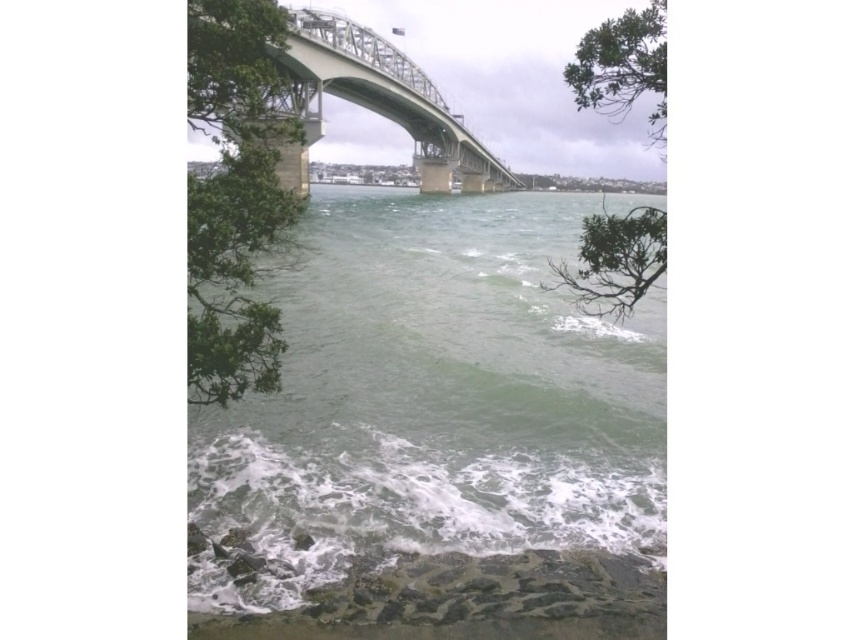
Which of these two, greenish water at center or green leafy branch at upper right, stands taller?

With more height is green leafy branch at upper right.

What are the coordinates of `greenish water at center` in the screenshot? It's located at (437, 440).

Is green leafy tree at upper left thinner than green leafy tree at upper right?

Yes.

Does point (215, 172) come behind point (646, 40)?

Yes, it is behind point (646, 40).

Identify the location of green leafy tree at upper left. The height and width of the screenshot is (640, 853). (235, 195).

Between steel bridge at center and green leafy tree at upper right, which one has more height?

Standing taller between the two is green leafy tree at upper right.

This screenshot has width=853, height=640. Describe the element at coordinates (375, 102) in the screenshot. I see `steel bridge at center` at that location.

Identify the location of steel bridge at center. (375, 102).

Identify the location of steel bridge at center. Image resolution: width=853 pixels, height=640 pixels. (375, 102).